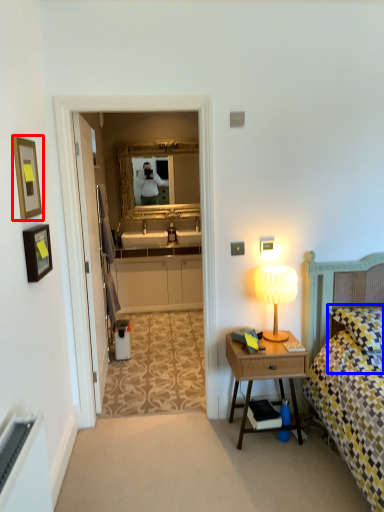
Question: Among these objects, which one is farthest to the camera, picture frame (highlighted by a red box) or pillow (highlighted by a blue box)?

Choices:
 (A) picture frame
 (B) pillow

Answer: (B)